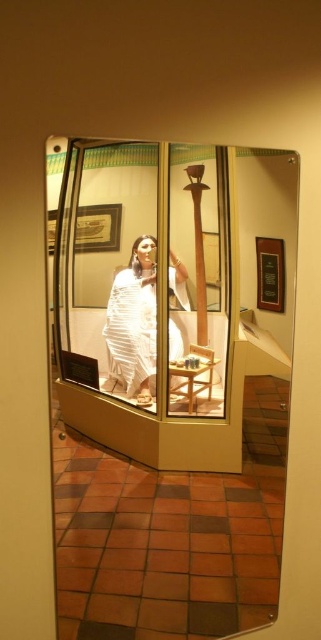
Question: Is clear glass mirror at center bigger than white silk saree at center?

Choices:
 (A) no
 (B) yes

Answer: (B)

Question: Which of the following is the farthest from the observer?

Choices:
 (A) white silk saree at center
 (B) clear glass mirror at center

Answer: (A)

Question: Which point is closer to the camera taking this photo?

Choices:
 (A) (105, 344)
 (B) (185, 156)

Answer: (A)

Question: Does clear glass mirror at center come behind white silk saree at center?

Choices:
 (A) yes
 (B) no

Answer: (B)

Question: Is clear glass mirror at center to the right of white silk saree at center from the viewer's perspective?

Choices:
 (A) no
 (B) yes

Answer: (B)